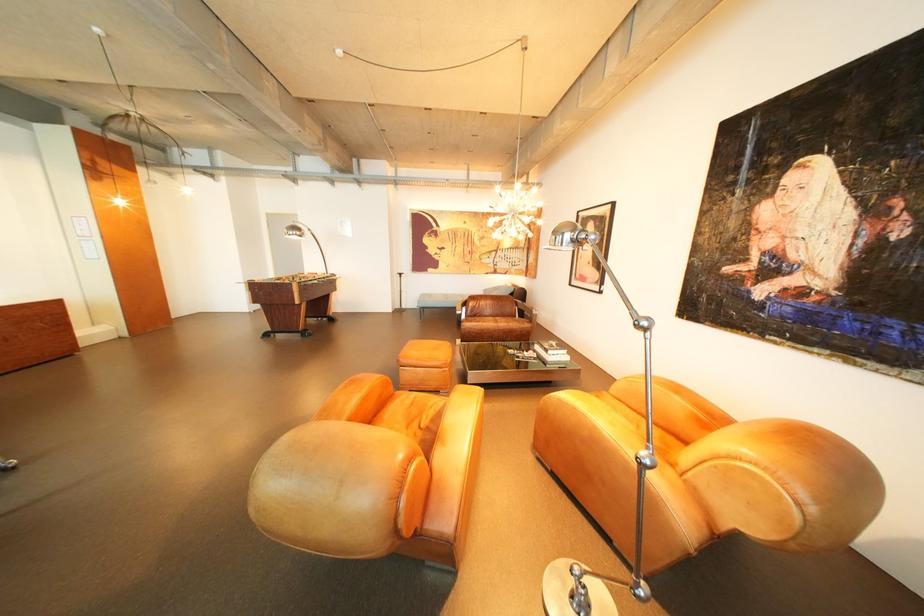
At what (x,y) coordinates should I click in order to perform the action: click on orange leather chair surface. Please return your answer as a coordinate pair (x, y). The width and height of the screenshot is (924, 616). Looking at the image, I should click on (419, 416).